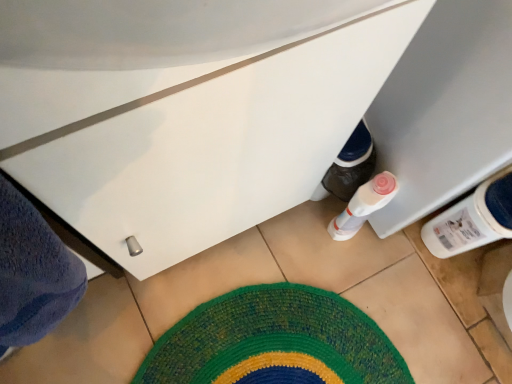
Question: Is white plastic bottle at lower right facing away from white glossy cabinet at lower center?

Choices:
 (A) no
 (B) yes

Answer: (A)

Question: Is white plastic bottle at lower right thinner than white glossy cabinet at lower center?

Choices:
 (A) no
 (B) yes

Answer: (A)

Question: Is white plastic bottle at lower right taller than white glossy cabinet at lower center?

Choices:
 (A) no
 (B) yes

Answer: (B)

Question: From a real-world perspective, is white plastic bottle at lower right on white glossy cabinet at lower center?

Choices:
 (A) no
 (B) yes

Answer: (A)

Question: Is white plastic bottle at lower right completely or partially outside of white glossy cabinet at lower center?

Choices:
 (A) yes
 (B) no

Answer: (A)

Question: From a real-world perspective, is white plastic bottle at lower right beneath white glossy cabinet at lower center?

Choices:
 (A) no
 (B) yes

Answer: (B)

Question: Is multicolored woven mat at center outside white glossy cabinet at lower center?

Choices:
 (A) yes
 (B) no

Answer: (A)

Question: From the image's perspective, is multicolored woven mat at center above white glossy cabinet at lower center?

Choices:
 (A) yes
 (B) no

Answer: (B)

Question: Is multicolored woven mat at center closer to camera compared to white glossy cabinet at lower center?

Choices:
 (A) yes
 (B) no

Answer: (B)

Question: Is multicolored woven mat at center beside white glossy cabinet at lower center?

Choices:
 (A) no
 (B) yes

Answer: (A)

Question: Does multicolored woven mat at center have a greater height compared to white glossy cabinet at lower center?

Choices:
 (A) yes
 (B) no

Answer: (B)

Question: Is multicolored woven mat at center at the right side of white glossy cabinet at lower center?

Choices:
 (A) yes
 (B) no

Answer: (A)

Question: Considering the relative sizes of white plastic bottle at lower right and multicolored woven mat at center in the image provided, is white plastic bottle at lower right wider than multicolored woven mat at center?

Choices:
 (A) yes
 (B) no

Answer: (B)